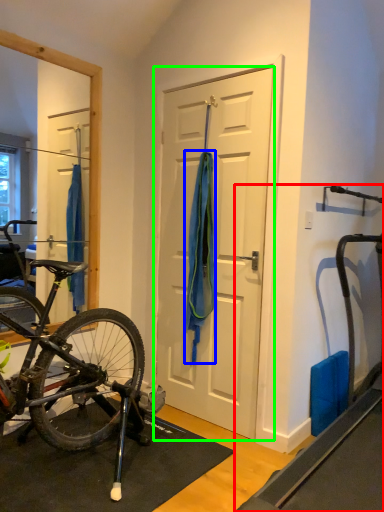
Question: Which is nearer to the treadmill (highlighted by a red box)? towel/napkin (highlighted by a blue box) or door (highlighted by a green box).

Choices:
 (A) towel/napkin
 (B) door

Answer: (B)